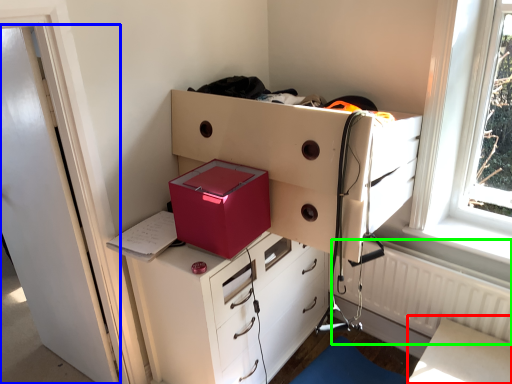
Question: Which is farther away from table (highlighted by a red box)? door (highlighted by a blue box) or radiator (highlighted by a green box)?

Choices:
 (A) door
 (B) radiator

Answer: (A)